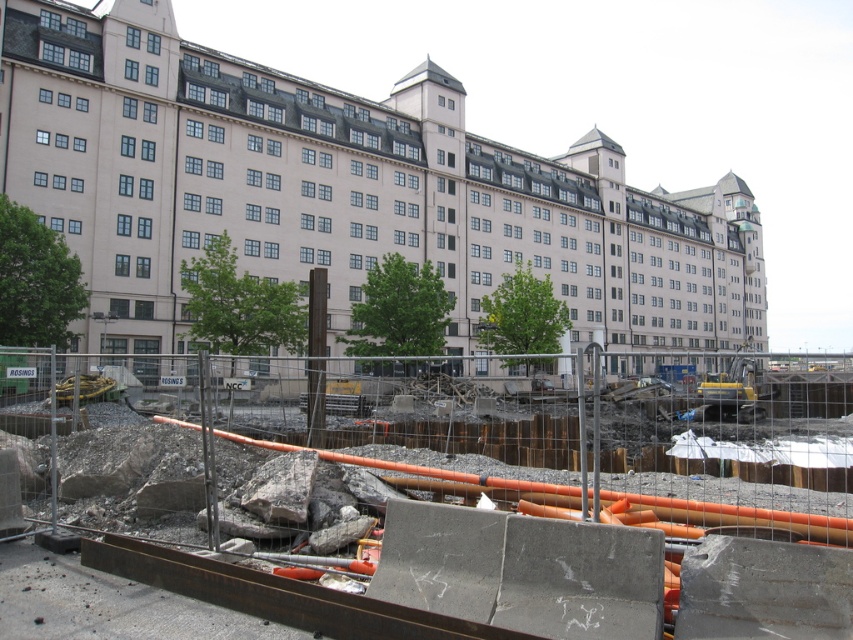
Which is behind, point (775, 525) or point (563, 275)?

Point (563, 275)

Which of these two, rusty metal pipes at center or light beige concrete building at center, stands taller?

light beige concrete building at center

Does point (804, 481) come farther from viewer compared to point (175, 74)?

That is False.

The height and width of the screenshot is (640, 853). Identify the location of rusty metal pipes at center. (474, 481).